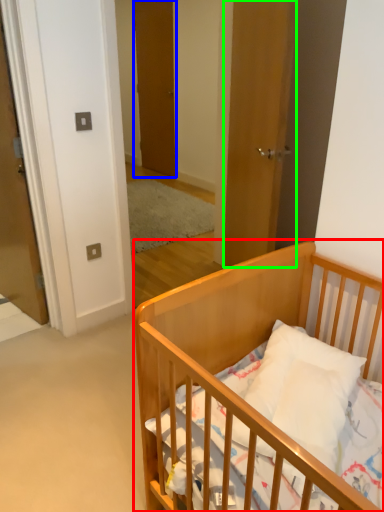
Question: Which object is positioned farthest from infant bed (highlighted by a red box)? Select from door (highlighted by a blue box) and door (highlighted by a green box).

Choices:
 (A) door
 (B) door

Answer: (A)